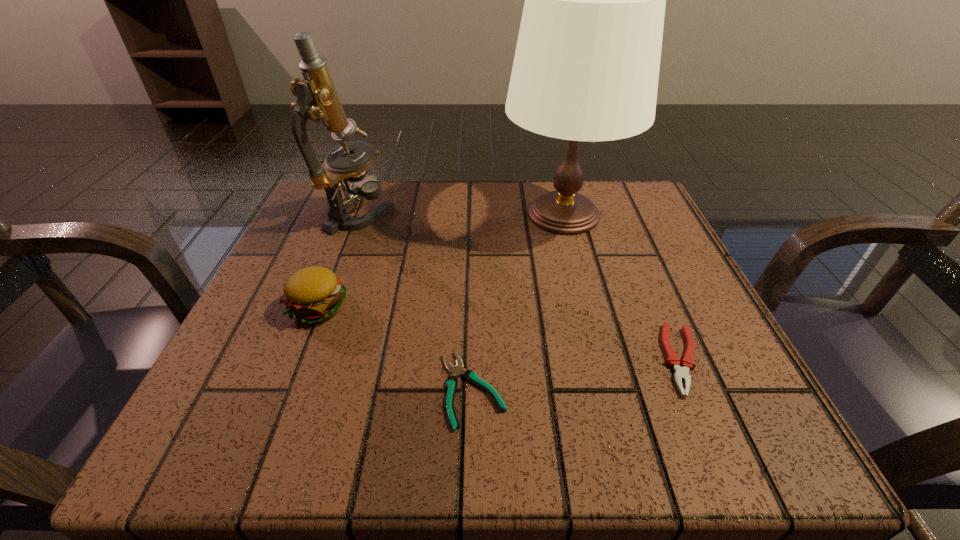
The width and height of the screenshot is (960, 540). Find the location of `free spot between the right pliers and the microscope`. free spot between the right pliers and the microscope is located at coordinates (521, 287).

Find the location of a particular element. The image size is (960, 540). free spot between the right pliers and the hamburger is located at coordinates (500, 333).

This screenshot has height=540, width=960. I want to click on blank region between the third tallest object and the shortest object, so click(x=396, y=348).

In order to click on free space between the hamburger and the shorter pliers in this screenshot , I will do `click(396, 348)`.

The width and height of the screenshot is (960, 540). I want to click on vacant point located between the fourth shortest object and the taller pliers, so click(x=521, y=287).

Find the location of `unoccupied position between the hamburger and the right pliers`. unoccupied position between the hamburger and the right pliers is located at coordinates (500, 333).

Identify the location of free area in between the third object from right to left and the right pliers. (577, 374).

You are a GUI agent. You are given a task and a screenshot of the screen. Output one action in this format:
    pyautogui.click(x=<x>, y=<y>)
    Task: Click on the vacant space in between the lamp and the microscope
    Image resolution: width=960 pixels, height=540 pixels.
    Given the screenshot: What is the action you would take?
    pyautogui.click(x=462, y=214)

Where is `object that is the third closest one to the third tallest object`? Image resolution: width=960 pixels, height=540 pixels. object that is the third closest one to the third tallest object is located at coordinates (586, 67).

At what (x,y) coordinates should I click in order to perform the action: click on object identified as the closest to the fourth shortest object. Please return your answer as a coordinate pair (x, y). Image resolution: width=960 pixels, height=540 pixels. Looking at the image, I should click on (314, 294).